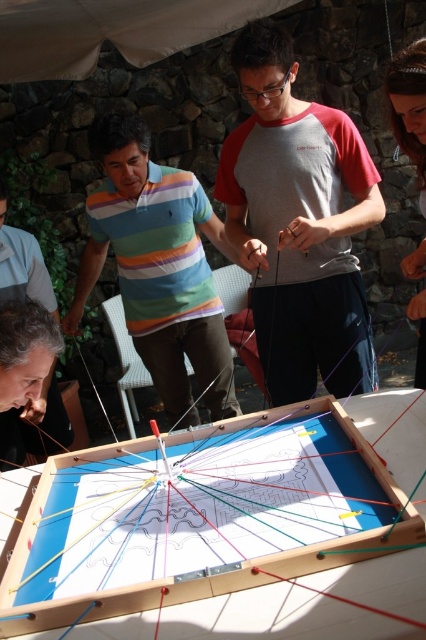
You are standing in front of the board and see two points marked as point 1 at coordinates point (x=149, y=246) and point 2 at coordinates point (x=43, y=275). Which point is closer to you?

Point 1 at coordinates point (x=149, y=246) is closer to you because it is further to the viewer than point 2 at coordinates point (x=43, y=275).